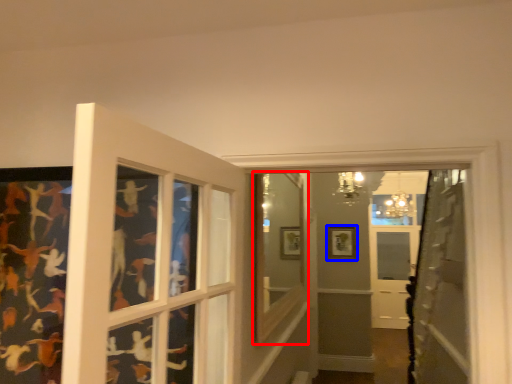
Question: Which of the following is the closest to the observer, window frame (highlighted by a red box) or picture frame (highlighted by a blue box)?

Choices:
 (A) window frame
 (B) picture frame

Answer: (A)